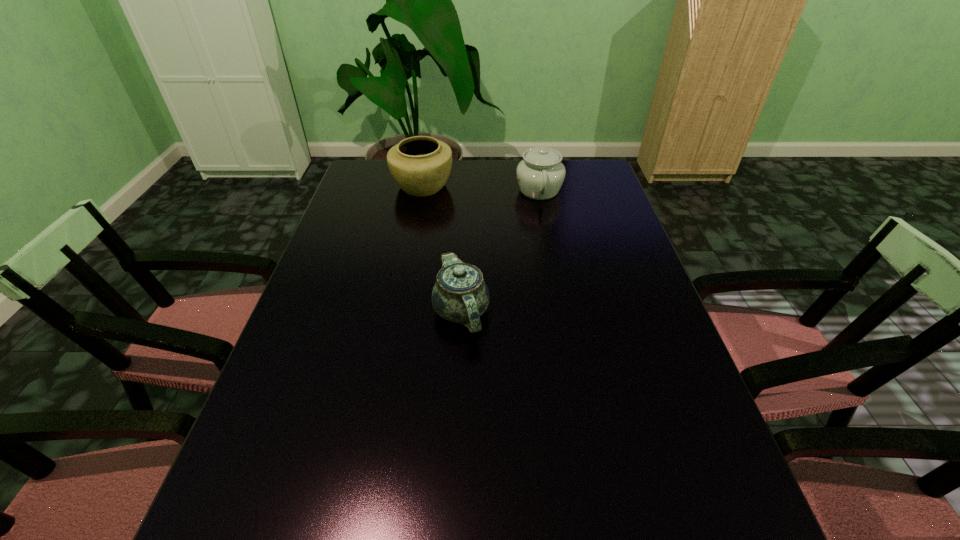
This screenshot has width=960, height=540. I want to click on object at the left edge, so click(420, 165).

Locate an element on the screen. This screenshot has height=540, width=960. object positioned at the right edge is located at coordinates (540, 175).

Where is `object positioned at the far left corner`? object positioned at the far left corner is located at coordinates (420, 165).

Where is `object that is positioned at the far right corner`? The height and width of the screenshot is (540, 960). object that is positioned at the far right corner is located at coordinates (540, 175).

Locate an element on the screen. free location at the far edge of the desktop is located at coordinates (453, 190).

Where is `vacant region at the near edge`? vacant region at the near edge is located at coordinates (491, 539).

The height and width of the screenshot is (540, 960). What are the coordinates of `vacant space at the left edge of the desktop` in the screenshot? It's located at (331, 300).

Find the location of a particular element. This screenshot has width=960, height=540. vacant space at the right edge is located at coordinates (578, 242).

You are a GUI agent. You are given a task and a screenshot of the screen. Output one action in this format:
    pyautogui.click(x=<x>, y=<y>)
    Task: Click on the vacant space at the far right corner
    The width and height of the screenshot is (960, 540).
    Given the screenshot: What is the action you would take?
    pyautogui.click(x=594, y=174)

The width and height of the screenshot is (960, 540). Identify the location of free spot between the rightmost object and the pottery. coord(481,188).